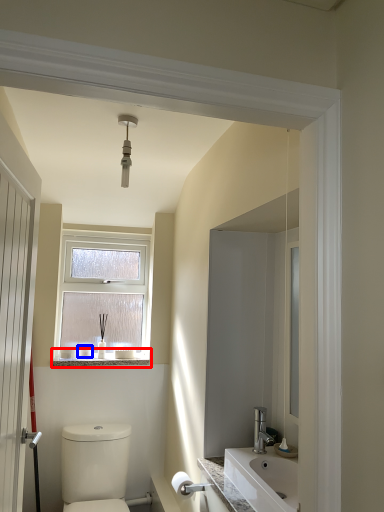
Question: Which object is closer to the camera taking this photo, window sill (highlighted by a red box) or toiletry (highlighted by a blue box)?

Choices:
 (A) window sill
 (B) toiletry

Answer: (A)